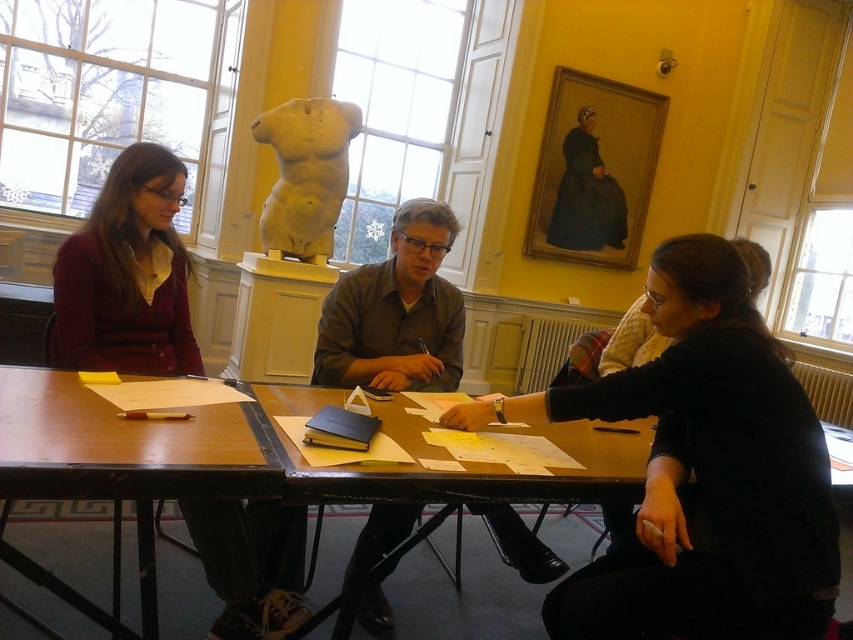
Which is more to the right, black matte sweater at lower right or brown wooden table at lower left?

black matte sweater at lower right is more to the right.

Which is above, black matte sweater at lower right or brown wooden table at lower left?

Positioned higher is brown wooden table at lower left.

Who is more distant from viewer, [647,552] or [71,396]?

Point [647,552]

What are the coordinates of `black matte sweater at lower right` in the screenshot? It's located at (701, 472).

Which of these two, matte brown shirt at center or wooden table at center, stands shorter?

With less height is wooden table at center.

Who is positioned more to the left, matte brown shirt at center or wooden table at center?

From the viewer's perspective, matte brown shirt at center appears more on the left side.

Does point (419, 291) come in front of point (569, 499)?

No, it is behind (569, 499).

This screenshot has width=853, height=640. I want to click on matte brown shirt at center, so click(396, 312).

Does matte maroon sweater at left have a greater height compared to white marble torso at center?

No.

Between matte maroon sweater at left and white marble torso at center, which one has more height?

Standing taller between the two is white marble torso at center.

Who is more distant from viewer, (283,577) or (289,164)?

The point (289,164) is behind.

The height and width of the screenshot is (640, 853). What are the coordinates of `matte maroon sweater at left` in the screenshot? It's located at (126, 275).